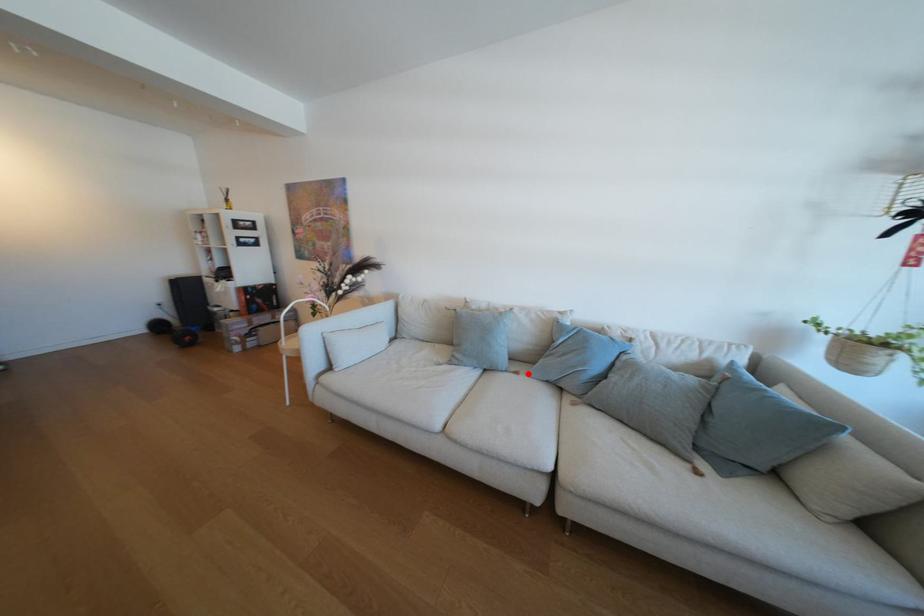
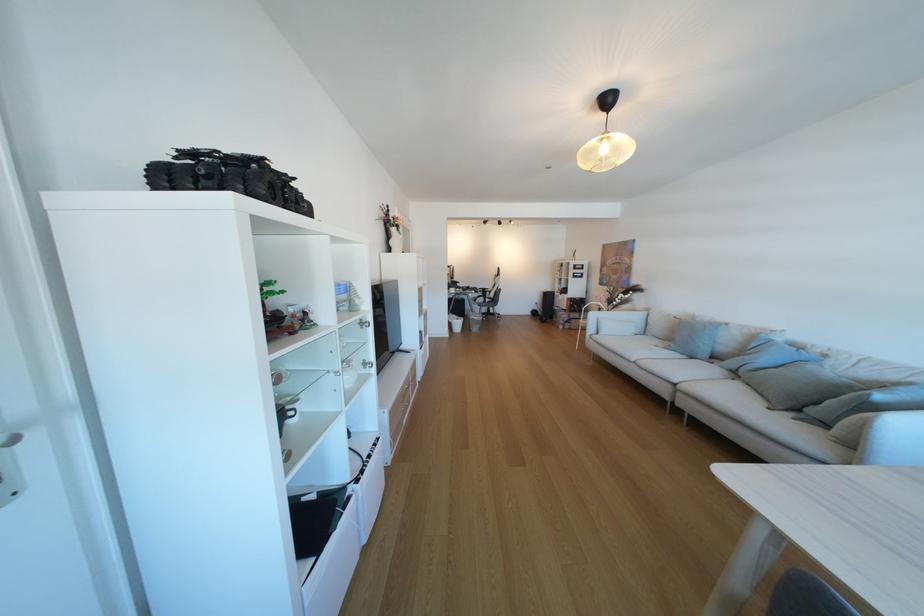
Where in the second image is the point corresponding to the highlighted location from the first image?

(723, 363)